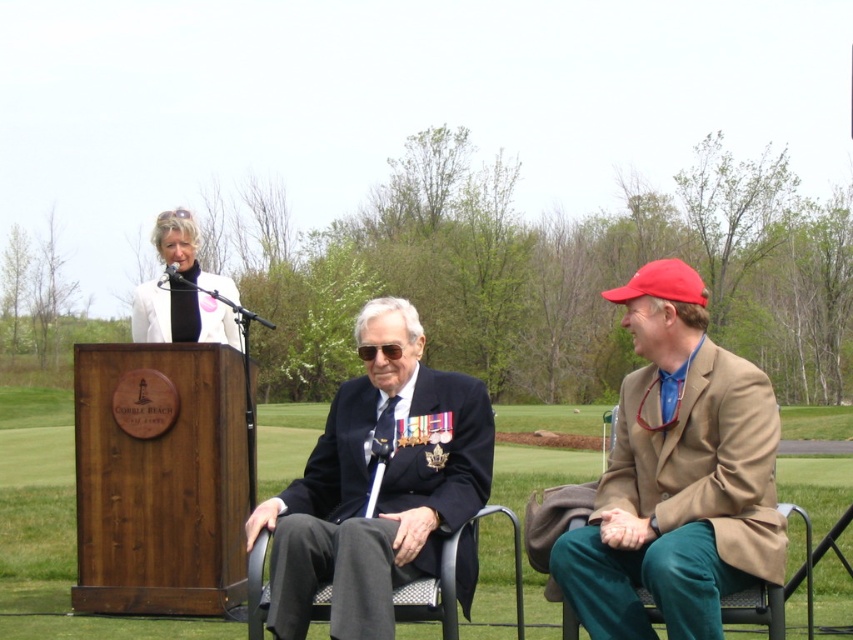
Can you confirm if tan fabric blazer at right is positioned to the left of navy blue fabric uniform at center?

No, tan fabric blazer at right is not to the left of navy blue fabric uniform at center.

What do you see at coordinates (679, 500) in the screenshot? I see `tan fabric blazer at right` at bounding box center [679, 500].

Which is behind, point (734, 509) or point (422, 452)?

Positioned behind is point (422, 452).

Where is `tan fabric blazer at right`? This screenshot has width=853, height=640. tan fabric blazer at right is located at coordinates (679, 500).

Does point (432, 492) come closer to viewer compared to point (140, 285)?

Yes, point (432, 492) is closer to viewer.

Identify the location of navy blue fabric uniform at center. (376, 502).

Is point (288, 492) less distant than point (229, 294)?

Yes, it is.

The height and width of the screenshot is (640, 853). Identify the location of navy blue fabric uniform at center. (376, 502).

Is tan fabric blazer at right taller than green grass at center?

Correct, tan fabric blazer at right is much taller as green grass at center.

Who is higher up, tan fabric blazer at right or green grass at center?

Positioned higher is tan fabric blazer at right.

Measure the distance between point (717,460) and camera.

The distance of point (717,460) from camera is 13.15 feet.

Locate an element on the screen. Image resolution: width=853 pixels, height=640 pixels. tan fabric blazer at right is located at coordinates (679, 500).